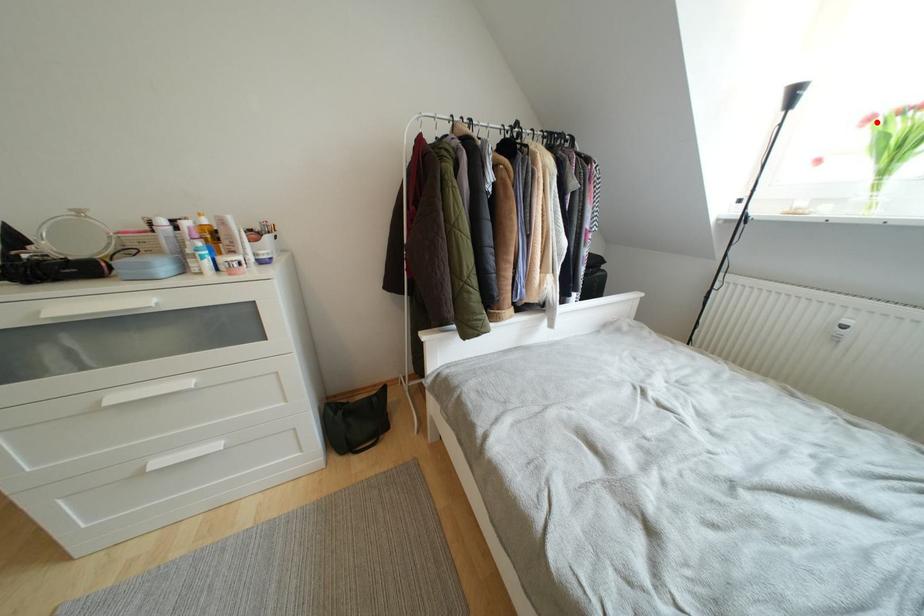
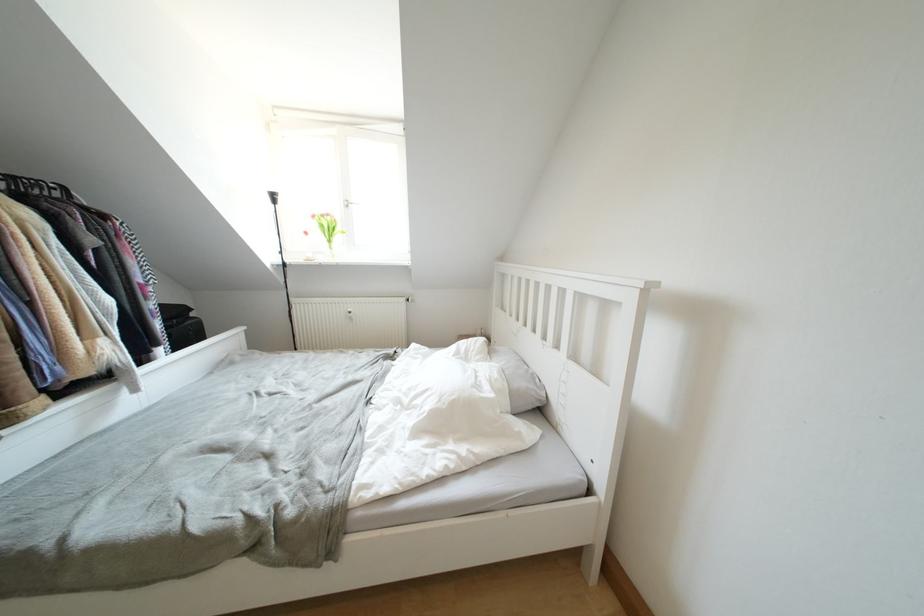
Question: I am providing you with two images of the same scene from different viewpoints. In image1, a red point is highlighted. Considering the same 3D point in image2, which of the following is correct?

Choices:
 (A) It is closer
 (B) It is farther

Answer: (A)